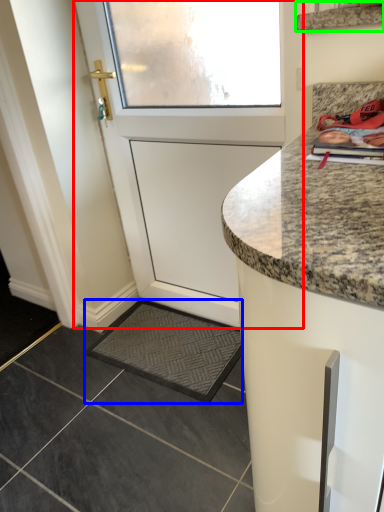
Question: Which is farther away from door (highlighted by a red box)? slate (highlighted by a blue box) or shelf (highlighted by a green box)?

Choices:
 (A) slate
 (B) shelf

Answer: (B)